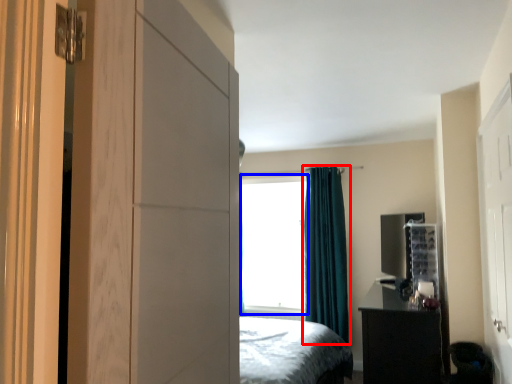
Question: Which object appears farthest to the camera in this image, curtain (highlighted by a red box) or window screen (highlighted by a blue box)?

Choices:
 (A) curtain
 (B) window screen

Answer: (B)